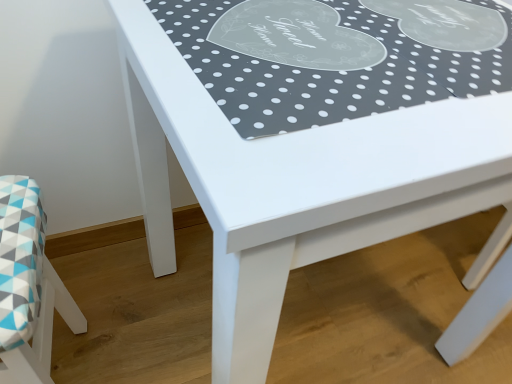
This screenshot has width=512, height=384. What are the coordinates of `geometric fabric cushion at lower left` in the screenshot? It's located at (28, 286).

Measure the distance between point [21,262] and camera.

They are 23.78 inches apart.

This screenshot has height=384, width=512. What do you see at coordinates (28, 286) in the screenshot? I see `geometric fabric cushion at lower left` at bounding box center [28, 286].

What is the approximate height of geometric fabric cushion at lower left?

geometric fabric cushion at lower left is 19.80 inches tall.

Identify the location of polka dot fabric placemat at upper center. The width and height of the screenshot is (512, 384). (337, 56).

What do you see at coordinates (337, 56) in the screenshot? The image size is (512, 384). I see `polka dot fabric placemat at upper center` at bounding box center [337, 56].

Locate an element on the screen. The height and width of the screenshot is (384, 512). geometric fabric cushion at lower left is located at coordinates (28, 286).

Considering the relative positions of geometric fabric cushion at lower left and polka dot fabric placemat at upper center in the image provided, is geometric fabric cushion at lower left to the right of polka dot fabric placemat at upper center from the viewer's perspective?

Incorrect, geometric fabric cushion at lower left is not on the right side of polka dot fabric placemat at upper center.

Consider the image. Is geometric fabric cushion at lower left positioned before polka dot fabric placemat at upper center?

No, the depth of geometric fabric cushion at lower left is greater than that of polka dot fabric placemat at upper center.

Is point (79, 320) farther from camera compared to point (313, 17)?

Yes, it is behind point (313, 17).

From the image's perspective, is geometric fabric cushion at lower left on polka dot fabric placemat at upper center?

Actually, geometric fabric cushion at lower left appears below polka dot fabric placemat at upper center in the image.

From a real-world perspective, between geometric fabric cushion at lower left and polka dot fabric placemat at upper center, who is vertically lower?

A: geometric fabric cushion at lower left is physically lower.

Does geometric fabric cushion at lower left have a greater width compared to polka dot fabric placemat at upper center?

Incorrect, the width of geometric fabric cushion at lower left does not surpass that of polka dot fabric placemat at upper center.

From their relative heights in the image, would you say geometric fabric cushion at lower left is taller or shorter than polka dot fabric placemat at upper center?

In the image, geometric fabric cushion at lower left appears to be taller than polka dot fabric placemat at upper center.

In the scene shown: Considering the sizes of objects geometric fabric cushion at lower left and polka dot fabric placemat at upper center in the image provided, who is bigger, geometric fabric cushion at lower left or polka dot fabric placemat at upper center?

Bigger between the two is geometric fabric cushion at lower left.

Is geometric fabric cushion at lower left positioned beyond the bounds of polka dot fabric placemat at upper center?

Yes, geometric fabric cushion at lower left is not within polka dot fabric placemat at upper center.

Is there a large distance between geometric fabric cushion at lower left and polka dot fabric placemat at upper center?

Actually, geometric fabric cushion at lower left and polka dot fabric placemat at upper center are a little close together.

Is geometric fabric cushion at lower left positioned with its back to polka dot fabric placemat at upper center?

geometric fabric cushion at lower left is not turned away from polka dot fabric placemat at upper center.

From the picture: Can you tell me how much geometric fabric cushion at lower left and polka dot fabric placemat at upper center differ in facing direction?

The facing directions of geometric fabric cushion at lower left and polka dot fabric placemat at upper center are 82.8 degrees apart.

At what (x,y) coordinates should I click in order to perform the action: click on tablecloth in front of the geometric fabric cushion at lower left. Please return your answer as a coordinate pair (x, y). Looking at the image, I should click on (x=337, y=56).

Which object is positioned more to the right, polka dot fabric placemat at upper center or geometric fabric cushion at lower left?

Positioned to the right is polka dot fabric placemat at upper center.

Considering the relative positions of polka dot fabric placemat at upper center and geometric fabric cushion at lower left in the image provided, is polka dot fabric placemat at upper center in front of geometric fabric cushion at lower left?

That is True.

Which is further, (x=250, y=26) or (x=80, y=315)?

Positioned behind is point (x=80, y=315).

Looking at this image, from the image's perspective, does polka dot fabric placemat at upper center appear lower than geometric fabric cushion at lower left?

Incorrect, from the image's perspective, polka dot fabric placemat at upper center is higher than geometric fabric cushion at lower left.

From a real-world perspective, does polka dot fabric placemat at upper center stand above geometric fabric cushion at lower left?

Yes, from a real-world perspective, polka dot fabric placemat at upper center is over geometric fabric cushion at lower left

Is polka dot fabric placemat at upper center wider or thinner than geometric fabric cushion at lower left?

Clearly, polka dot fabric placemat at upper center has more width compared to geometric fabric cushion at lower left.

Is polka dot fabric placemat at upper center taller or shorter than geometric fabric cushion at lower left?

Considering their sizes, polka dot fabric placemat at upper center has less height than geometric fabric cushion at lower left.

Considering the sizes of polka dot fabric placemat at upper center and geometric fabric cushion at lower left in the image, is polka dot fabric placemat at upper center bigger or smaller than geometric fabric cushion at lower left?

polka dot fabric placemat at upper center is smaller than geometric fabric cushion at lower left.

Is polka dot fabric placemat at upper center located outside geometric fabric cushion at lower left?

Indeed, polka dot fabric placemat at upper center is completely outside geometric fabric cushion at lower left.

Is polka dot fabric placemat at upper center directly adjacent to geometric fabric cushion at lower left?

No, polka dot fabric placemat at upper center is not with geometric fabric cushion at lower left.

Could you tell me if polka dot fabric placemat at upper center is turned towards geometric fabric cushion at lower left?

No, polka dot fabric placemat at upper center is not aimed at geometric fabric cushion at lower left.

How different are the orientations of polka dot fabric placemat at upper center and geometric fabric cushion at lower left in degrees?

polka dot fabric placemat at upper center and geometric fabric cushion at lower left are facing 82.8 degrees away from each other.

Based on the photo, measure the distance from polka dot fabric placemat at upper center to geometric fabric cushion at lower left.

polka dot fabric placemat at upper center is 20.45 inches away from geometric fabric cushion at lower left.

At what (x,y) coordinates should I click in order to perform the action: click on chair lying below the polka dot fabric placemat at upper center (from the image's perspective). Please return your answer as a coordinate pair (x, y). Looking at the image, I should click on (28, 286).

Locate an element on the screen. Image resolution: width=512 pixels, height=384 pixels. tablecloth on the right of geometric fabric cushion at lower left is located at coordinates (337, 56).

Identify the location of tablecloth in front of the geometric fabric cushion at lower left. (337, 56).